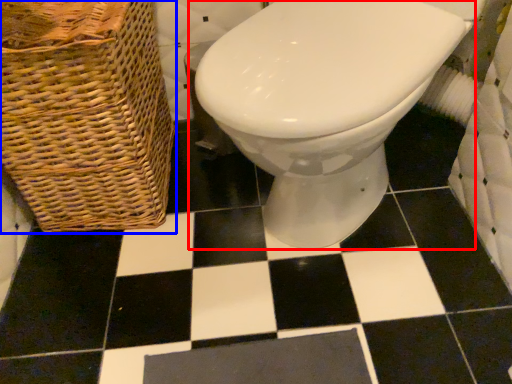
Question: Which object is closer to the camera taking this photo, toilet (highlighted by a red box) or basket (highlighted by a blue box)?

Choices:
 (A) toilet
 (B) basket

Answer: (A)